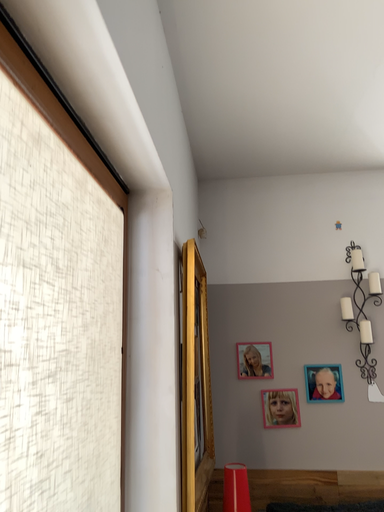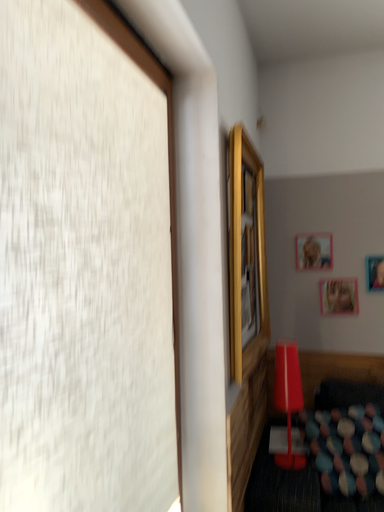
Question: Which way did the camera rotate in the video?

Choices:
 (A) rotated left
 (B) rotated right

Answer: (A)